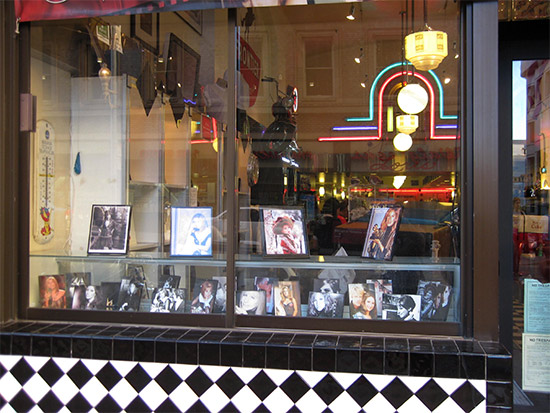
You are a GUI agent. You are given a task and a screenshot of the screen. Output one action in this format:
    pyautogui.click(x=<x>, y=<y>)
    Task: Click on the framed photo
    The image size is (550, 413).
    Given the screenshot: What is the action you would take?
    pyautogui.click(x=380, y=241), pyautogui.click(x=275, y=218), pyautogui.click(x=109, y=230)